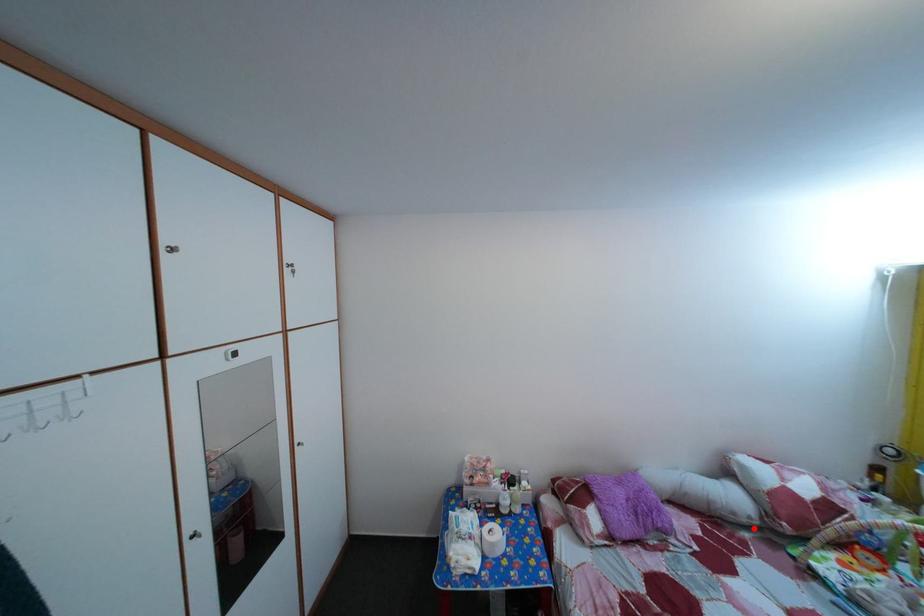
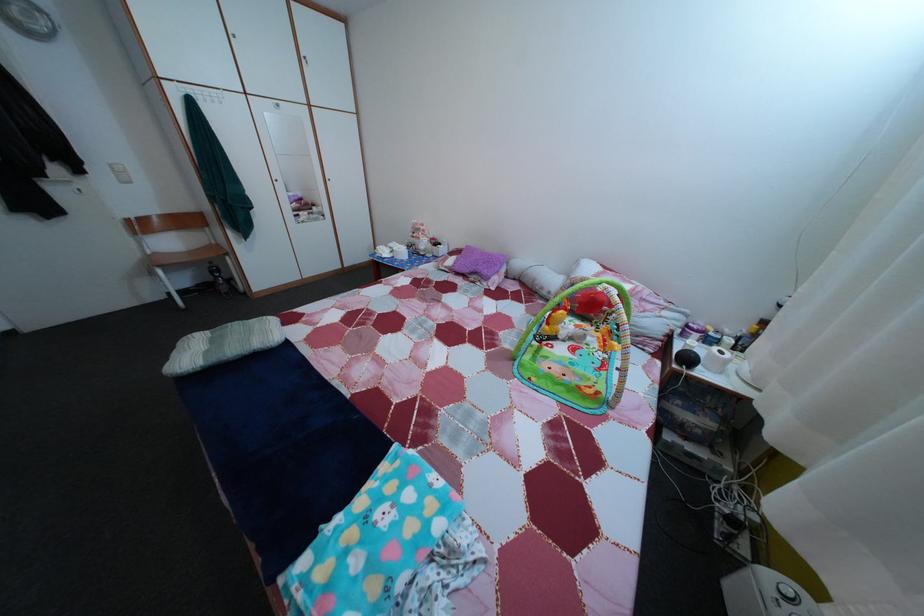
Where in the second image is the point corresponding to the highlighted location from the first image?

(553, 301)